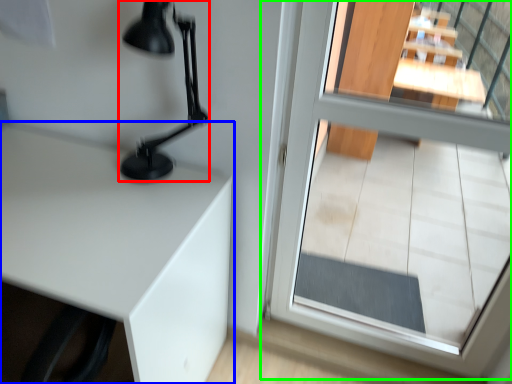
Question: Considering the real-world distances, which object is closest to table lamp (highlighted by a red box)? table (highlighted by a blue box) or glass door (highlighted by a green box).

Choices:
 (A) table
 (B) glass door

Answer: (A)